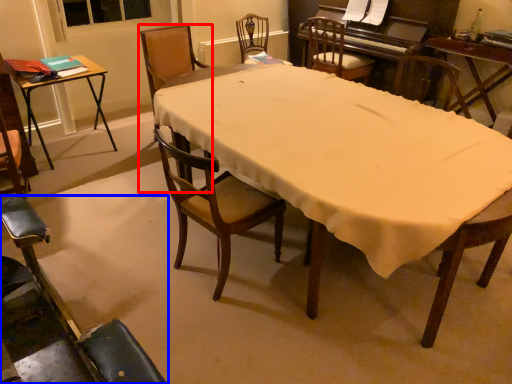
Question: Which of the following is the closest to the observer, chair (highlighted by a red box) or chair (highlighted by a blue box)?

Choices:
 (A) chair
 (B) chair

Answer: (B)